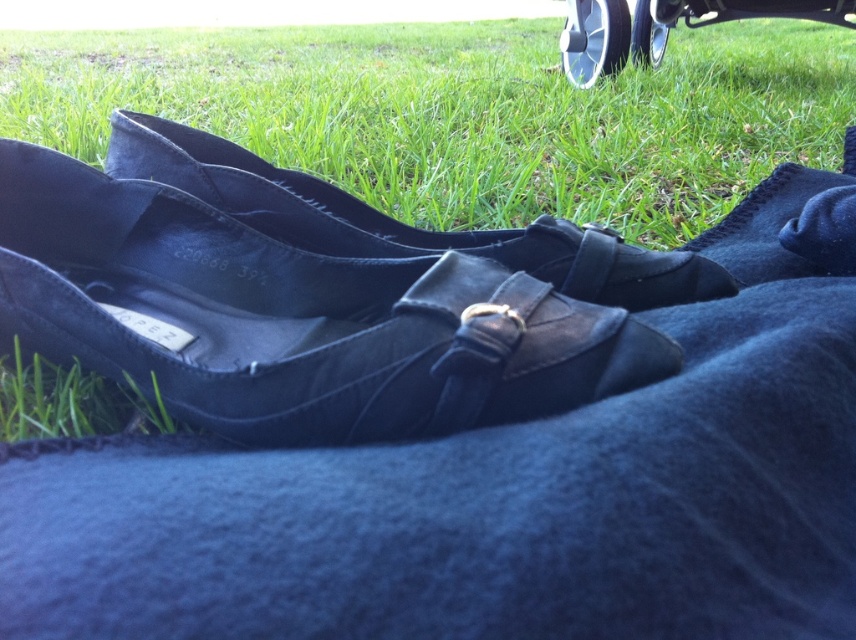
Question: Can you confirm if green grass at center is wider than matte black dress shoe at center?

Choices:
 (A) yes
 (B) no

Answer: (A)

Question: Which point is closer to the camera?

Choices:
 (A) matte black shoe at center
 (B) silver metallic wheel at upper right
 (C) green grass at center
 (D) matte black dress shoe at center

Answer: (D)

Question: Considering the real-world distances, which object is farthest from the green grass at center?

Choices:
 (A) matte black shoe at center
 (B) matte black dress shoe at center

Answer: (A)

Question: Can you confirm if green grass at center is wider than silver metallic wheel at upper right?

Choices:
 (A) no
 (B) yes

Answer: (B)

Question: Is the position of green grass at center more distant than that of matte black shoe at center?

Choices:
 (A) no
 (B) yes

Answer: (B)

Question: Among these points, which one is nearest to the camera?

Choices:
 (A) (467, 90)
 (B) (217, 365)

Answer: (B)